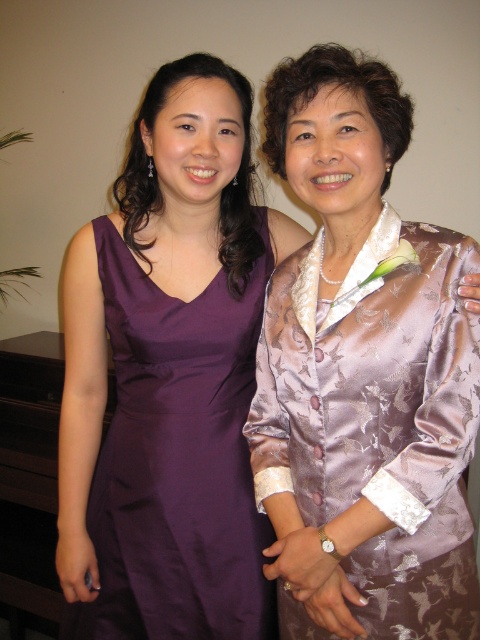
Who is lower down, silky purple dress at center or purple satin dress at left?

purple satin dress at left

From the picture: Is silky purple dress at center shorter than purple satin dress at left?

No, silky purple dress at center is not shorter than purple satin dress at left.

Which is in front, point (369, 602) or point (115, 419)?

Point (369, 602) is more forward.

This screenshot has height=640, width=480. In order to click on silky purple dress at center in this screenshot , I will do `click(362, 374)`.